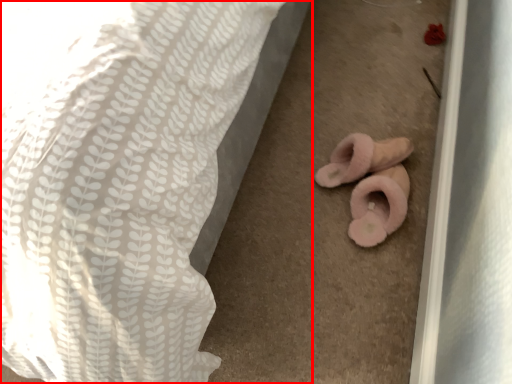
Question: From the image's perspective, what is the correct spatial positioning of bed (annotated by the red box) in reference to stuff?

Choices:
 (A) below
 (B) above

Answer: (B)